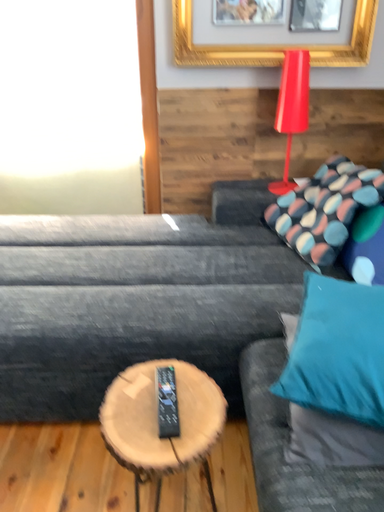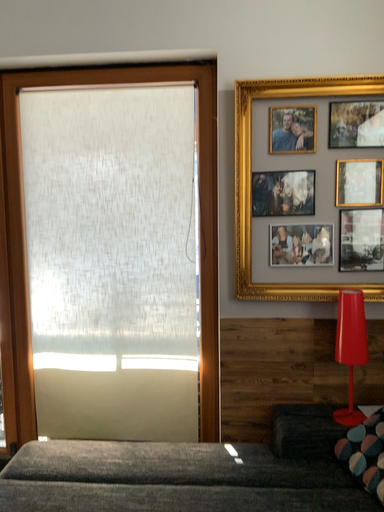
Question: How did the camera likely rotate when shooting the video?

Choices:
 (A) rotated upward
 (B) rotated downward

Answer: (A)